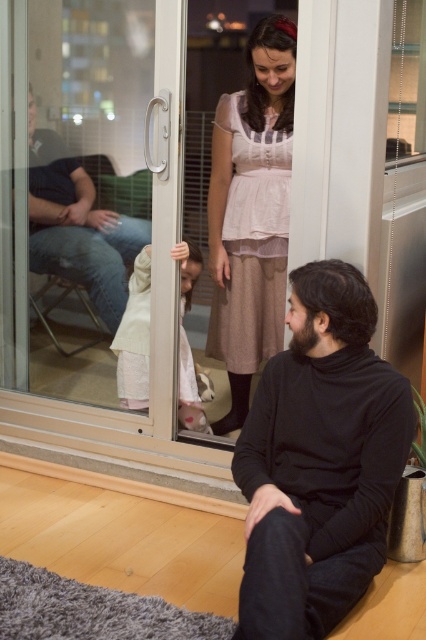
Is jeans at left above light pink fabric dress at center?

Correct, jeans at left is located above light pink fabric dress at center.

Consider the image. Can you confirm if jeans at left is taller than light pink fabric dress at center?

Yes, jeans at left is taller than light pink fabric dress at center.

Is point (77, 266) positioned in front of point (149, 342)?

No.

The height and width of the screenshot is (640, 426). In order to click on jeans at left in this screenshot , I will do `click(81, 236)`.

Between black turtleneck sweater at center and pink fabric dress at center, which one is positioned higher?

→ pink fabric dress at center is above.

In the scene shown: Can you confirm if black turtleneck sweater at center is positioned to the right of pink fabric dress at center?

Indeed, black turtleneck sweater at center is positioned on the right side of pink fabric dress at center.

This screenshot has height=640, width=426. In order to click on black turtleneck sweater at center in this screenshot , I will do `click(319, 460)`.

Can you confirm if pink fabric dress at center is positioned to the left of jeans at left?

In fact, pink fabric dress at center is to the right of jeans at left.

Between pink fabric dress at center and jeans at left, which one appears on the left side from the viewer's perspective?

jeans at left is more to the left.

Does point (293, 44) come closer to viewer compared to point (62, 157)?

Yes, point (293, 44) is in front of point (62, 157).

Where is `pink fabric dress at center`? pink fabric dress at center is located at coordinates (252, 212).